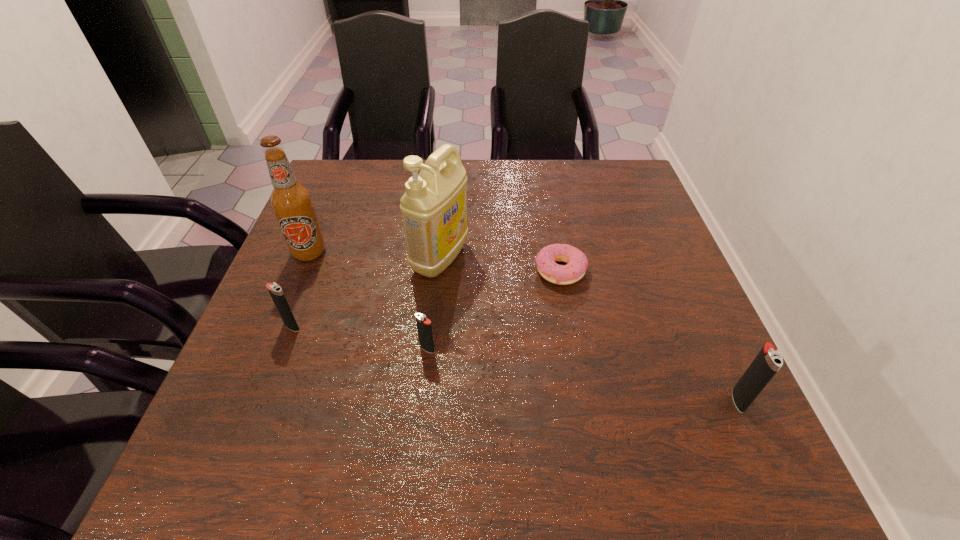
What are the coordinates of `free space that satisfies the following two spatial constraints: 1. on the front side of the nearest object; 2. on the right side of the second igniter from left to right` in the screenshot? It's located at (422, 400).

The width and height of the screenshot is (960, 540). I want to click on free location that satisfies the following two spatial constraints: 1. on the front side of the nearest object; 2. on the right side of the detergent, so click(427, 400).

You are a GUI agent. You are given a task and a screenshot of the screen. Output one action in this format:
    pyautogui.click(x=<x>, y=<y>)
    Task: Click on the vacant point that satisfies the following two spatial constraints: 1. on the front label of the beer bottle; 2. on the right side of the rightmost igniter
    
    Given the screenshot: What is the action you would take?
    pyautogui.click(x=249, y=400)

The height and width of the screenshot is (540, 960). I want to click on vacant space that satisfies the following two spatial constraints: 1. on the front label of the fourth shortest object; 2. on the left side of the beer bottle, so click(249, 400).

At what (x,y) coordinates should I click in order to perform the action: click on vacant area that satisfies the following two spatial constraints: 1. on the front label of the detergent; 2. on the left side of the beer bottle. Please return your answer as a coordinate pair (x, y). This screenshot has height=540, width=960. Looking at the image, I should click on (307, 258).

Identify the location of vacant space that satisfies the following two spatial constraints: 1. on the front label of the beer bottle; 2. on the left side of the doughnut. (301, 271).

This screenshot has height=540, width=960. Identify the location of vacant position in the image that satisfies the following two spatial constraints: 1. on the front label of the nearest igniter; 2. on the right side of the beer bottle. (249, 400).